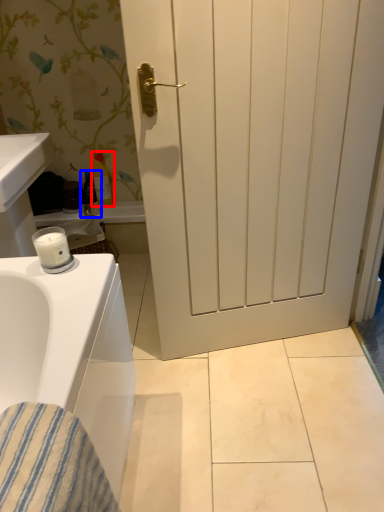
Question: Among these objects, which one is farthest to the camera, toiletry (highlighted by a red box) or toiletry (highlighted by a blue box)?

Choices:
 (A) toiletry
 (B) toiletry

Answer: (B)